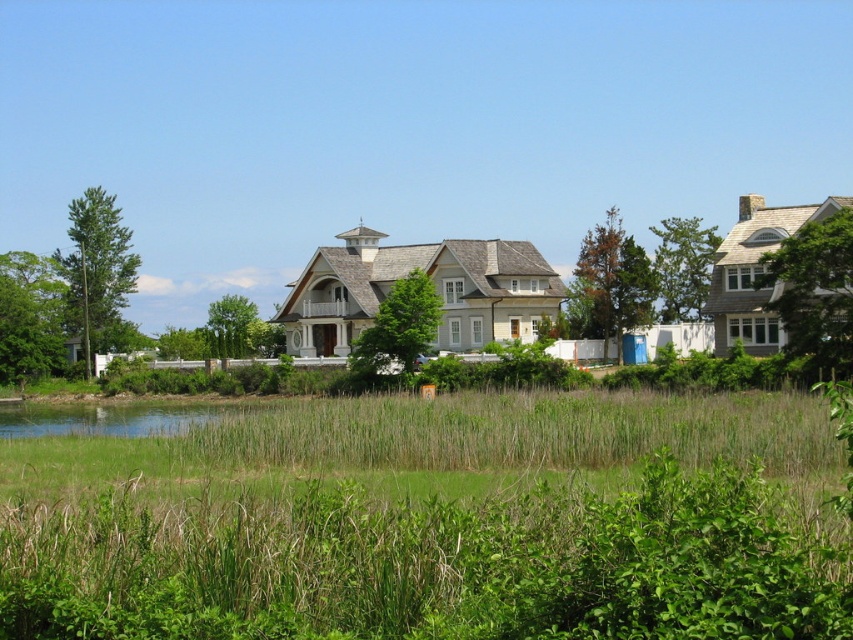
You are a gardener who wants to plant a new flower bed. You have two options for locations in the image. The first is the green grass at center, and the second is the clear water at lower left. Which location is higher in elevation?

The green grass at center is located above the clear water at lower left, so the green grass at center is higher in elevation.